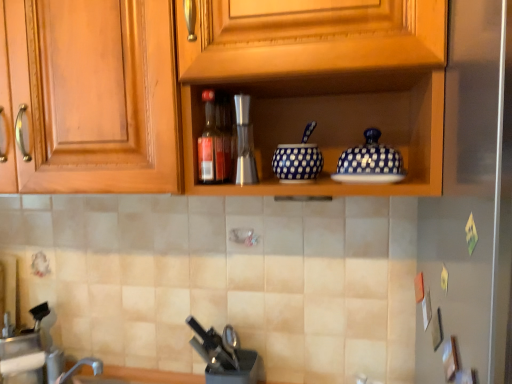
Question: Is blue dotted bowl at center in front of matte glass bottle at center?

Choices:
 (A) yes
 (B) no

Answer: (B)

Question: Is blue dotted bowl at center looking in the opposite direction of matte glass bottle at center?

Choices:
 (A) no
 (B) yes

Answer: (A)

Question: Does blue dotted bowl at center have a lesser height compared to matte glass bottle at center?

Choices:
 (A) no
 (B) yes

Answer: (B)

Question: From the image's perspective, is blue dotted bowl at center under matte glass bottle at center?

Choices:
 (A) yes
 (B) no

Answer: (A)

Question: Is the depth of blue dotted bowl at center greater than that of matte glass bottle at center?

Choices:
 (A) no
 (B) yes

Answer: (B)

Question: Are blue dotted bowl at center and matte glass bottle at center far apart?

Choices:
 (A) yes
 (B) no

Answer: (B)

Question: Does brushed metal faucet at lower left appear on the right side of wooden cabinet at upper center?

Choices:
 (A) no
 (B) yes

Answer: (A)

Question: Is brushed metal faucet at lower left facing towards wooden cabinet at upper center?

Choices:
 (A) no
 (B) yes

Answer: (A)

Question: From the image's perspective, is brushed metal faucet at lower left on wooden cabinet at upper center?

Choices:
 (A) no
 (B) yes

Answer: (A)

Question: Is brushed metal faucet at lower left turned away from wooden cabinet at upper center?

Choices:
 (A) yes
 (B) no

Answer: (B)

Question: Does brushed metal faucet at lower left come in front of wooden cabinet at upper center?

Choices:
 (A) no
 (B) yes

Answer: (A)

Question: Does brushed metal faucet at lower left touch wooden cabinet at upper center?

Choices:
 (A) yes
 (B) no

Answer: (B)

Question: Considering the relative sizes of black plastic knife block at lower center and blue dotted bowl at center in the image provided, is black plastic knife block at lower center shorter than blue dotted bowl at center?

Choices:
 (A) yes
 (B) no

Answer: (B)